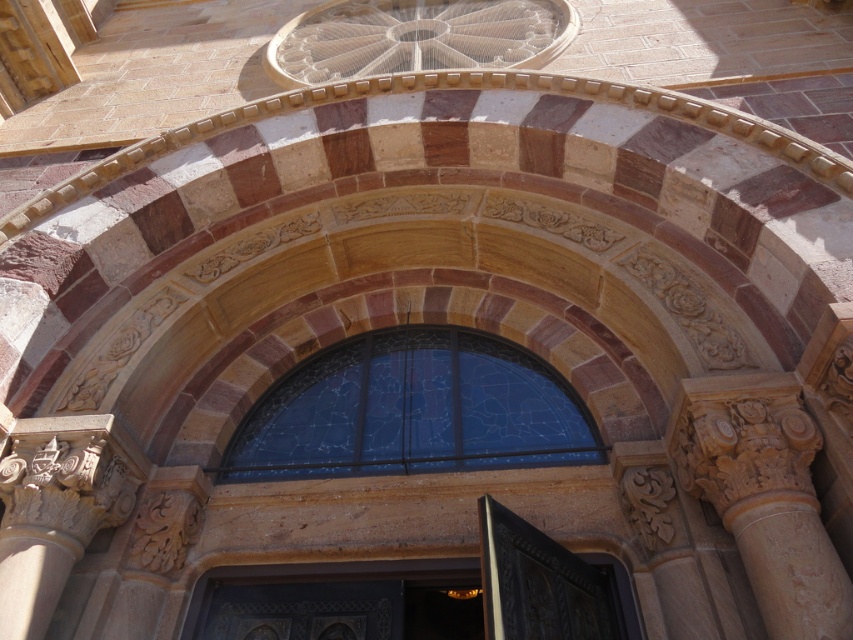
You are standing in front of the building and want to take a photo of the stained glass window at center. If your camera has a maximum focus range of 25 meters, will you be able to capture it clearly?

The stained glass window at center is 24.72 meters away from camera, which is within the 25 meters maximum focus range. Therefore, you can capture it clearly.

In the scene shown: You are standing in front of the building and want to take a photo of the stained glass window at center. Considering the distance, can you estimate how far you are from the window?

The stained glass window at center is 24.72 meters away from the viewer, so you are approximately 24.72 meters away from the window.